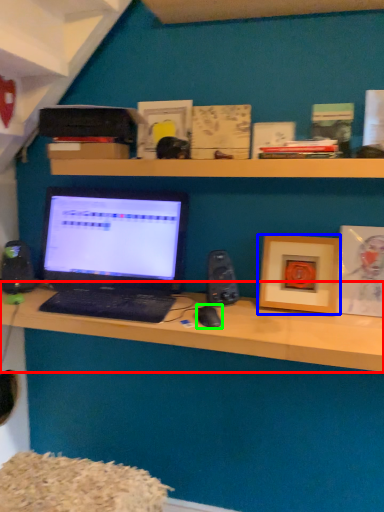
Question: Estimate the real-world distances between objects in this image. Which object is closer to desk (highlighted by a red box), picture frame (highlighted by a blue box) or mouse (highlighted by a green box)?

Choices:
 (A) picture frame
 (B) mouse

Answer: (A)